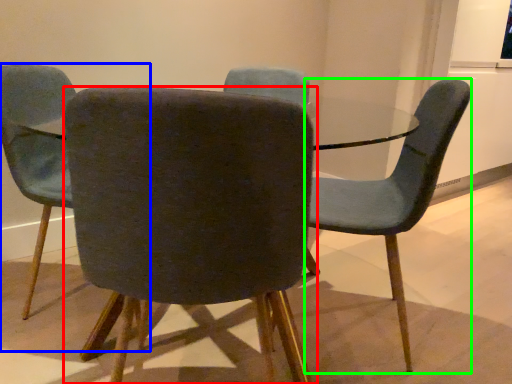
Question: Which object is the farthest from chair (highlighted by a red box)? Choose among these: chair (highlighted by a blue box) or chair (highlighted by a green box).

Choices:
 (A) chair
 (B) chair

Answer: (A)